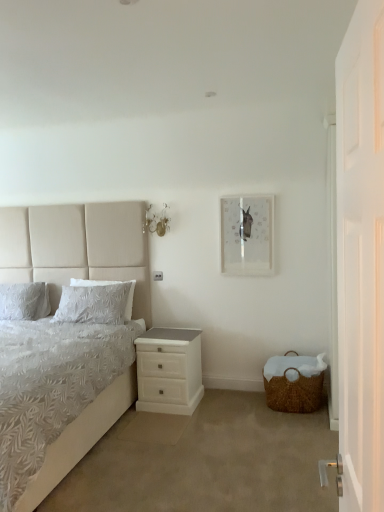
Question: Can you confirm if white textured pillow at left, which appears as the second pillow when viewed from the right, is positioned to the right of white textured bed at left?

Choices:
 (A) yes
 (B) no

Answer: (B)

Question: Does white textured pillow at left, which is counted as the 1th pillow, starting from the left, appear on the left side of white textured bed at left?

Choices:
 (A) no
 (B) yes

Answer: (B)

Question: Can you confirm if white textured pillow at left, which appears as the second pillow when viewed from the right, is shorter than white textured bed at left?

Choices:
 (A) no
 (B) yes

Answer: (B)

Question: Is white textured pillow at left, which appears as the second pillow when viewed from the right, positioned with its back to white textured bed at left?

Choices:
 (A) yes
 (B) no

Answer: (A)

Question: Is white textured pillow at left, which is counted as the 1th pillow, starting from the left, positioned before white textured bed at left?

Choices:
 (A) no
 (B) yes

Answer: (A)

Question: From the image's perspective, does white textured pillow at left, which is counted as the 1th pillow, starting from the left, appear lower than white textured bed at left?

Choices:
 (A) no
 (B) yes

Answer: (A)

Question: Can you confirm if clear glass picture frame at upper center is shorter than white textured pillow at left, which appears as the second pillow when viewed from the right?

Choices:
 (A) no
 (B) yes

Answer: (A)

Question: Does clear glass picture frame at upper center have a larger size compared to white textured pillow at left, which is counted as the 1th pillow, starting from the left?

Choices:
 (A) yes
 (B) no

Answer: (B)

Question: Is clear glass picture frame at upper center not within white textured pillow at left, which is counted as the 1th pillow, starting from the left?

Choices:
 (A) yes
 (B) no

Answer: (A)

Question: Can you confirm if clear glass picture frame at upper center is thinner than white textured pillow at left, which appears as the second pillow when viewed from the right?

Choices:
 (A) no
 (B) yes

Answer: (B)

Question: From the image's perspective, is clear glass picture frame at upper center under white textured pillow at left, which appears as the second pillow when viewed from the right?

Choices:
 (A) yes
 (B) no

Answer: (B)

Question: Considering the relative sizes of clear glass picture frame at upper center and white textured pillow at left, which appears as the second pillow when viewed from the right, in the image provided, is clear glass picture frame at upper center smaller than white textured pillow at left, which appears as the second pillow when viewed from the right,?

Choices:
 (A) yes
 (B) no

Answer: (A)

Question: From a real-world perspective, is woven brown basket at lower right physically below white glossy nightstand at lower center?

Choices:
 (A) no
 (B) yes

Answer: (B)